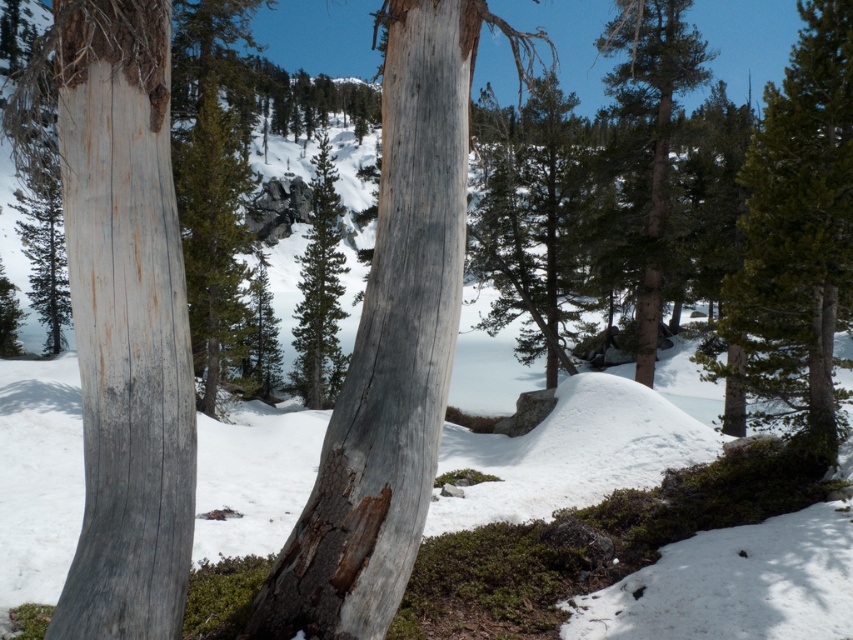
You are an environmental scientist assessing the health of trees in a winter landscape. You observe the green textured tree at center and the green textured pine tree at center. Which of these two trees has a wider trunk?

The green textured tree at center has a wider trunk than the green textured pine tree at center, as its width is larger according to the description.